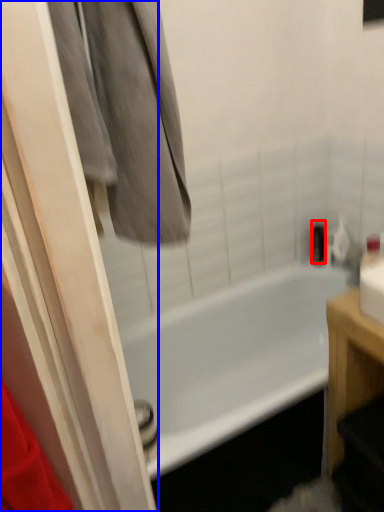
Question: Which object appears closest to the camera in this image, toiletry (highlighted by a red box) or screen door (highlighted by a blue box)?

Choices:
 (A) toiletry
 (B) screen door

Answer: (B)